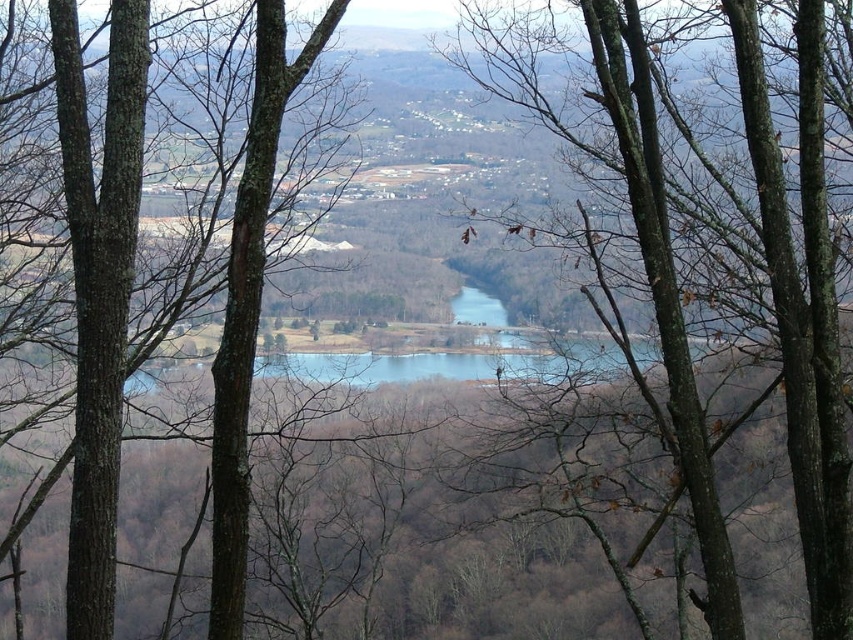
Question: In this image, where is brown rough bark tree at center located relative to brown rough tree at left?

Choices:
 (A) above
 (B) below

Answer: (B)

Question: Which point is closer to the camera?

Choices:
 (A) brown rough bark tree at center
 (B) brown rough tree at left

Answer: (A)

Question: Can you confirm if brown rough bark tree at center is positioned to the left of brown rough tree at left?

Choices:
 (A) no
 (B) yes

Answer: (A)

Question: Which point is closer to the camera?

Choices:
 (A) click(828, 566)
 (B) click(67, 598)

Answer: (A)

Question: Can you confirm if brown rough bark tree at center is bigger than brown rough tree at left?

Choices:
 (A) yes
 (B) no

Answer: (A)